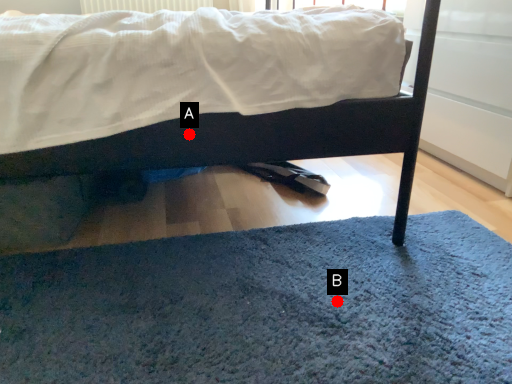
Question: Two points are circled on the image, labeled by A and B beside each circle. Which point is farther to the camera?

Choices:
 (A) A is further
 (B) B is further

Answer: (A)